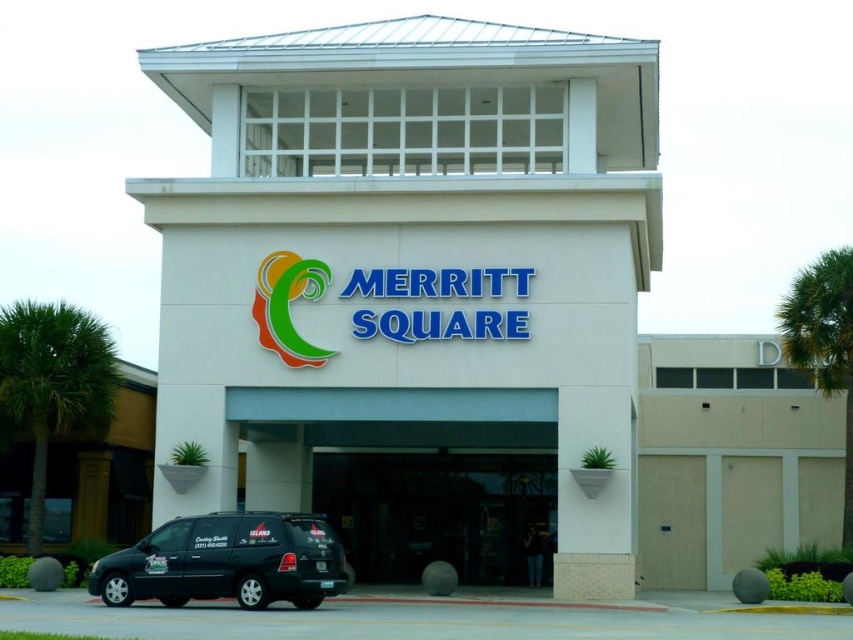
Is transparent glass door at center behind matte black van at lower left?

Yes.

Is point (392, 573) positioned in front of point (119, 573)?

That is False.

The image size is (853, 640). Describe the element at coordinates (438, 513) in the screenshot. I see `transparent glass door at center` at that location.

The height and width of the screenshot is (640, 853). I want to click on transparent glass door at center, so click(438, 513).